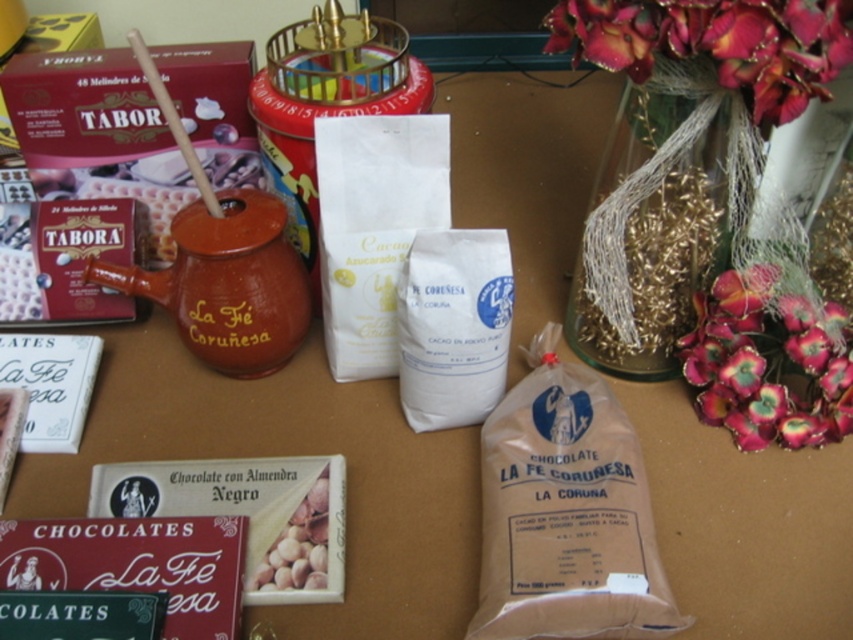
Question: Can you confirm if pink silk flowers at upper right is positioned to the left of silky pink petals at upper right?

Choices:
 (A) no
 (B) yes

Answer: (B)

Question: Which point is closer to the camera taking this photo?

Choices:
 (A) 270,227
 (B) 764,376
 (C) 498,428
 (D) 289,531

Answer: (D)

Question: Does brown paper bag at center appear under brown matte chocolate bar at center?

Choices:
 (A) yes
 (B) no

Answer: (B)

Question: Which point is closer to the camera?

Choices:
 (A) pink silk flowers at upper right
 (B) silky pink petals at upper right
 (C) brown matte chocolate bar at center
 (D) brown paper bag at center

Answer: (A)

Question: Which point appears farthest from the camera in this image?

Choices:
 (A) (328, 504)
 (B) (780, 384)
 (C) (531, 481)

Answer: (B)

Question: Can you confirm if matte clay teapot at center-left is positioned below brown matte chocolate bar at center?

Choices:
 (A) yes
 (B) no

Answer: (B)